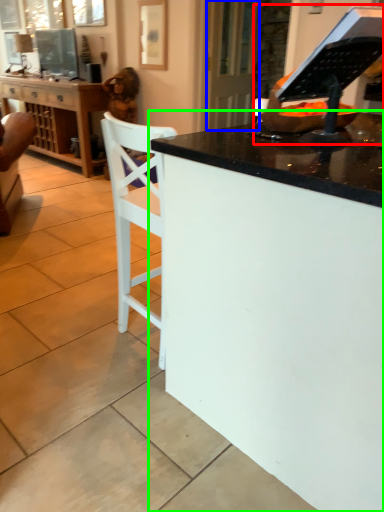
Question: Which is nearer to the appliance (highlighted by a red box)? glass door (highlighted by a blue box) or desk (highlighted by a green box).

Choices:
 (A) glass door
 (B) desk

Answer: (B)